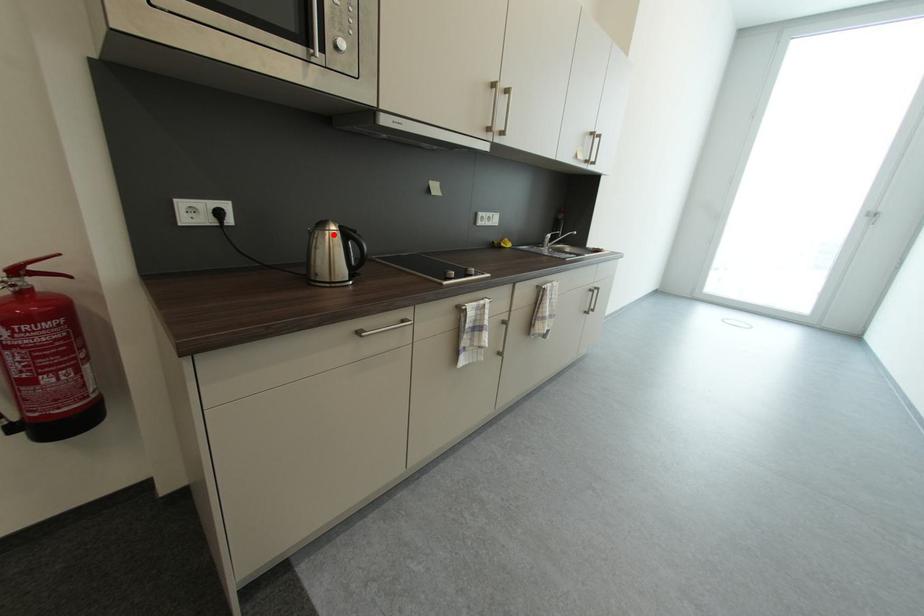
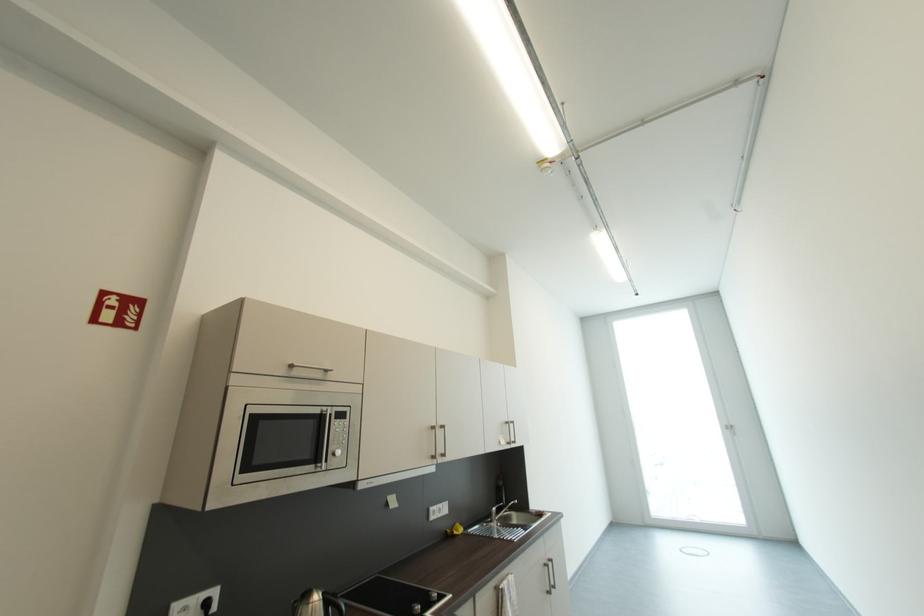
Locate, in the second image, the point that corresponds to the highlighted location in the first image.

(317, 607)